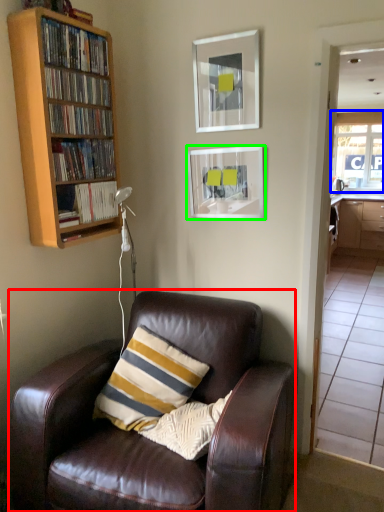
Question: Considering the real-world distances, which object is closest to chair (highlighted by a red box)? window (highlighted by a blue box) or picture frame (highlighted by a green box).

Choices:
 (A) window
 (B) picture frame

Answer: (B)